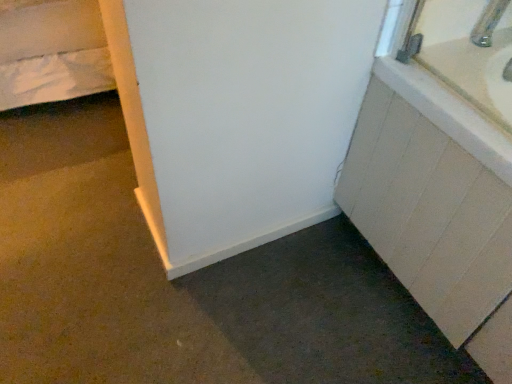
Where is `metallic silver faucet at upper right`? The height and width of the screenshot is (384, 512). metallic silver faucet at upper right is located at coordinates (488, 22).

Measure the distance between point (492, 19) and camera.

Point (492, 19) and camera are 3.49 feet apart.

What do you see at coordinates (488, 22) in the screenshot?
I see `metallic silver faucet at upper right` at bounding box center [488, 22].

Describe the element at coordinates (440, 172) in the screenshot. I see `white matte cabinet at right` at that location.

This screenshot has width=512, height=384. What are the coordinates of `white matte cabinet at right` in the screenshot? It's located at (440, 172).

Locate an element on the screen. metallic silver faucet at upper right is located at coordinates (488, 22).

Considering the relative positions of white matte cabinet at right and metallic silver faucet at upper right in the image provided, is white matte cabinet at right to the left of metallic silver faucet at upper right from the viewer's perspective?

No, white matte cabinet at right is not to the left of metallic silver faucet at upper right.

Considering the relative positions of white matte cabinet at right and metallic silver faucet at upper right in the image provided, is white matte cabinet at right behind metallic silver faucet at upper right?

No, white matte cabinet at right is closer to the viewer.

Is point (479, 74) closer or farther from the camera than point (487, 42)?

Point (479, 74) is closer to the camera than point (487, 42).

From the image's perspective, which one is positioned lower, white matte cabinet at right or metallic silver faucet at upper right?

From the image's view, white matte cabinet at right is below.

From a real-world perspective, is white matte cabinet at right positioned under metallic silver faucet at upper right based on gravity?

Yes, from a real-world perspective, white matte cabinet at right is beneath metallic silver faucet at upper right.

Which object is wider, white matte cabinet at right or metallic silver faucet at upper right?

white matte cabinet at right is wider.

Considering the relative sizes of white matte cabinet at right and metallic silver faucet at upper right in the image provided, is white matte cabinet at right taller than metallic silver faucet at upper right?

Correct, white matte cabinet at right is much taller as metallic silver faucet at upper right.

Who is smaller, white matte cabinet at right or metallic silver faucet at upper right?

metallic silver faucet at upper right.

Would you say white matte cabinet at right contains metallic silver faucet at upper right?

Actually, metallic silver faucet at upper right is outside white matte cabinet at right.

Would you say white matte cabinet at right is a long distance from metallic silver faucet at upper right?

No, white matte cabinet at right is not far from metallic silver faucet at upper right.

Does white matte cabinet at right turn towards metallic silver faucet at upper right?

No.

At what (x,y) coordinates should I click in order to perform the action: click on bathroom cabinet lying in front of the metallic silver faucet at upper right. Please return your answer as a coordinate pair (x, y). Looking at the image, I should click on (440, 172).

Considering the relative positions of metallic silver faucet at upper right and white matte cabinet at right in the image provided, is metallic silver faucet at upper right to the left of white matte cabinet at right from the viewer's perspective?

Correct, you'll find metallic silver faucet at upper right to the left of white matte cabinet at right.

In the image, is metallic silver faucet at upper right positioned in front of or behind white matte cabinet at right?

metallic silver faucet at upper right is positioned farther from the viewer than white matte cabinet at right.

Is point (490, 34) closer to viewer compared to point (381, 202)?

Yes, point (490, 34) is in front of point (381, 202).

From the image's perspective, does metallic silver faucet at upper right appear higher than white matte cabinet at right?

Yes.

From a real-world perspective, is metallic silver faucet at upper right below white matte cabinet at right?

Incorrect, from a real-world perspective, metallic silver faucet at upper right is higher than white matte cabinet at right.

Considering the sizes of objects metallic silver faucet at upper right and white matte cabinet at right in the image provided, who is wider, metallic silver faucet at upper right or white matte cabinet at right?

white matte cabinet at right is wider.

Who is shorter, metallic silver faucet at upper right or white matte cabinet at right?

metallic silver faucet at upper right.

From the picture: Between metallic silver faucet at upper right and white matte cabinet at right, which one has smaller size?

metallic silver faucet at upper right.

Which is correct: metallic silver faucet at upper right is inside white matte cabinet at right, or outside of it?

metallic silver faucet at upper right is outside white matte cabinet at right.

From the picture: Can you see metallic silver faucet at upper right touching white matte cabinet at right?

No.

Is metallic silver faucet at upper right facing towards white matte cabinet at right?

No.

What's the angular difference between metallic silver faucet at upper right and white matte cabinet at right's facing directions?

metallic silver faucet at upper right and white matte cabinet at right are facing 88.4 degrees away from each other.

Where is `faucet to the left of white matte cabinet at right`? The image size is (512, 384). faucet to the left of white matte cabinet at right is located at coordinates (488, 22).

Where is `bathroom cabinet below the metallic silver faucet at upper right (from a real-world perspective)`? bathroom cabinet below the metallic silver faucet at upper right (from a real-world perspective) is located at coordinates (440, 172).

I want to click on bathroom cabinet in front of the metallic silver faucet at upper right, so click(440, 172).